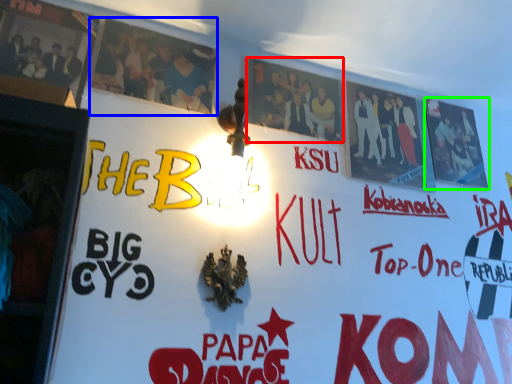
Question: Considering the real-world distances, which object is closest to poster (highlighted by a red box)? poster (highlighted by a blue box) or poster (highlighted by a green box).

Choices:
 (A) poster
 (B) poster

Answer: (A)